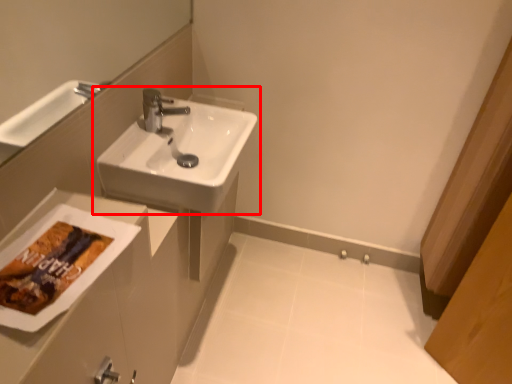
Question: From the image's perspective, considering the relative positions of sink (annotated by the red box) and porcelain in the image provided, where is sink (annotated by the red box) located with respect to the staircase?

Choices:
 (A) below
 (B) above

Answer: (B)